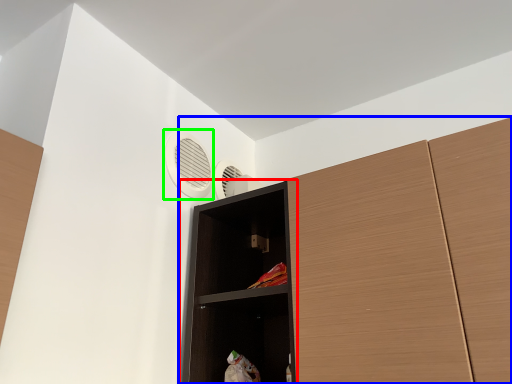
Question: Which object is the farthest from shelf (highlighted by a red box)? Choose among these: cupboard (highlighted by a blue box) or air conditioning (highlighted by a green box).

Choices:
 (A) cupboard
 (B) air conditioning

Answer: (B)